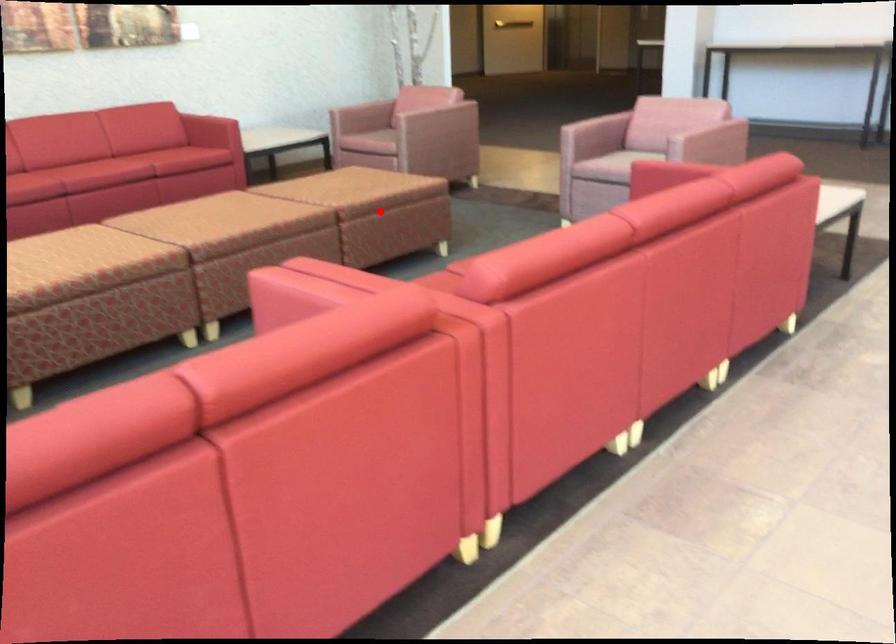
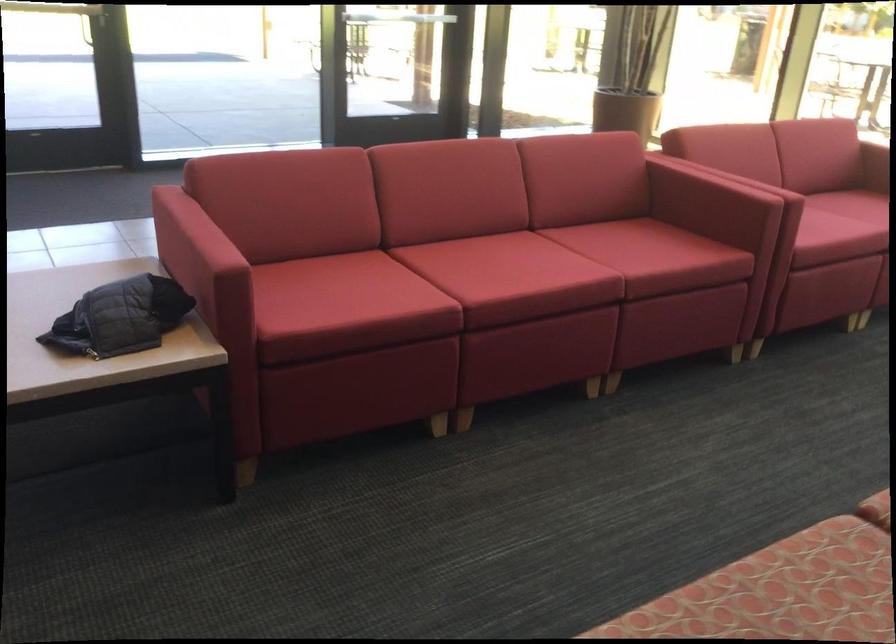
Question: I am providing you with two images of the same scene from different viewpoints. A red point is marked on the first image. Can you still see the location of the red point in image 2?

Choices:
 (A) Yes
 (B) No

Answer: (B)